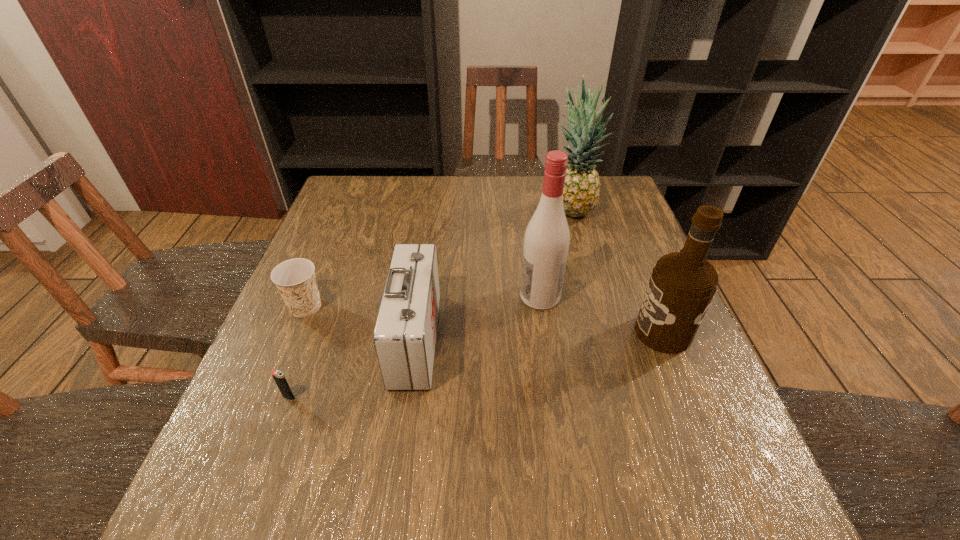
You are a GUI agent. You are given a task and a screenshot of the screen. Output one action in this format:
    pyautogui.click(x=<x>, y=<y>)
    Task: Click on the free space located 0.180m on the left of the pineapple
    The height and width of the screenshot is (540, 960).
    Given the screenshot: What is the action you would take?
    pyautogui.click(x=488, y=211)

At what (x,y) coordinates should I click in order to perform the action: click on free location located on the label of the third object from right to left. Please return your answer as a coordinate pair (x, y). The height and width of the screenshot is (540, 960). Looking at the image, I should click on (411, 296).

At what (x,y) coordinates should I click in order to perform the action: click on vacant space situated 0.220m on the label of the third object from right to left. Please return your answer as a coordinate pair (x, y). This screenshot has width=960, height=540. Looking at the image, I should click on (427, 296).

At what (x,y) coordinates should I click in order to perform the action: click on vacant area situated on the label of the third object from right to left. Please return your answer as a coordinate pair (x, y). Image resolution: width=960 pixels, height=540 pixels. Looking at the image, I should click on (352, 296).

I want to click on vacant area situated on the label of the fourth shortest object, so click(476, 332).

Where is `vacant space located on the label of the fourth shortest object`? This screenshot has width=960, height=540. vacant space located on the label of the fourth shortest object is located at coordinates (594, 332).

Locate an element on the screen. The image size is (960, 540). vacant space located 0.150m on the label of the fourth shortest object is located at coordinates (567, 332).

Find the location of a particular element. The image size is (960, 540). vacant area situated on the front-facing side of the first-aid kit is located at coordinates (473, 339).

This screenshot has width=960, height=540. In order to click on blank space located on the back of the fifth tallest object in this screenshot , I will do `click(343, 215)`.

Find the location of a particular element. The height and width of the screenshot is (540, 960). vacant area located on the back of the shortest object is located at coordinates (303, 357).